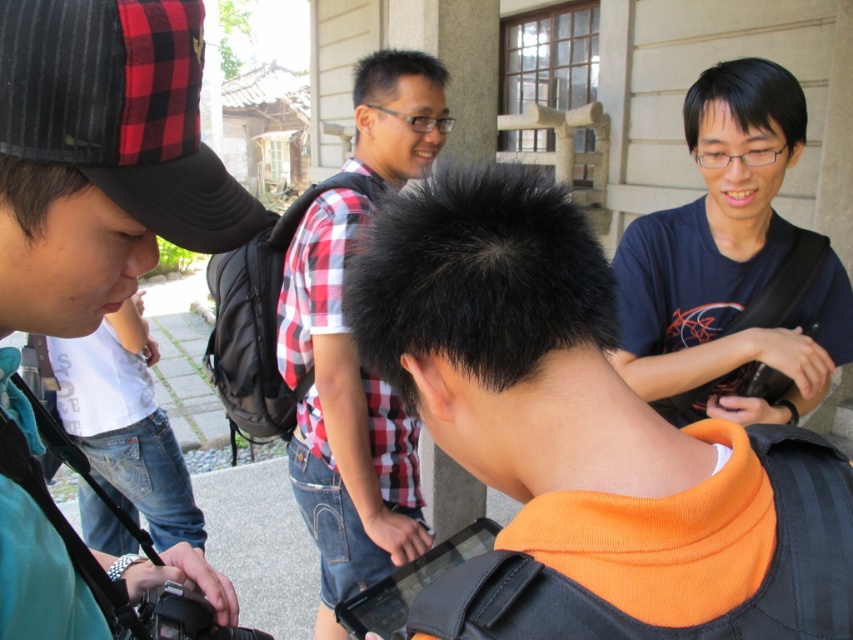
Consider the image. Does dark blue t-shirt at upper right have a lesser width compared to checkered fabric shirt at center?

Incorrect, dark blue t-shirt at upper right's width is not less than checkered fabric shirt at center's.

Which is in front, point (621, 259) or point (334, 385)?

Point (621, 259) is more forward.

Which is in front, point (672, 227) or point (410, 481)?

Point (672, 227) is in front.

At what (x,y) coordinates should I click in order to perform the action: click on dark blue t-shirt at upper right. Please return your answer as a coordinate pair (x, y). This screenshot has width=853, height=640. Looking at the image, I should click on (728, 259).

Image resolution: width=853 pixels, height=640 pixels. Find the location of `orange fleece at center`. orange fleece at center is located at coordinates (583, 438).

Between point (704, 497) and point (102, 4), which one is positioned behind?

Point (704, 497)

Is point (840, 609) positioned after point (123, 276)?

No.

Locate an element on the screen. orange fleece at center is located at coordinates (583, 438).

At what (x,y) coordinates should I click in order to perform the action: click on orange fleece at center. Please return your answer as a coordinate pair (x, y). Looking at the image, I should click on (583, 438).

Between point (738, 451) and point (177, 198), which one is positioned in front?

Point (738, 451) is more forward.

Identify the location of orange fleece at center. (583, 438).